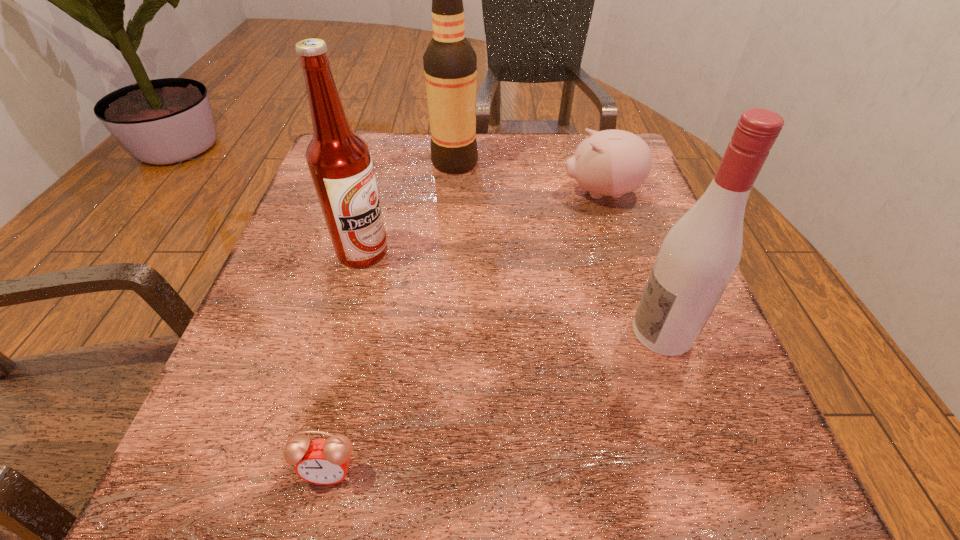
Find the location of a particular element. This screenshot has width=960, height=540. vacant space located on the label of the farthest alcohol is located at coordinates (633, 163).

Where is `free space located on the label side of the second nearest alcohol`? The width and height of the screenshot is (960, 540). free space located on the label side of the second nearest alcohol is located at coordinates (468, 251).

Identify the location of vacant region located 0.140m on the label of the nearest alcohol. (544, 332).

Locate an element on the screen. This screenshot has width=960, height=540. free space located on the label of the nearest alcohol is located at coordinates (482, 332).

This screenshot has width=960, height=540. In order to click on vacant space situated 0.190m on the label of the nearest alcohol in this screenshot , I will do `click(513, 332)`.

Identify the location of free region located at the snout of the second farthest object. (384, 193).

The height and width of the screenshot is (540, 960). Identify the location of free region located at the snout of the second farthest object. (384, 193).

You are a GUI agent. You are given a task and a screenshot of the screen. Output one action in this format:
    pyautogui.click(x=<x>, y=<y>)
    Task: Click on the vacant area situated 0.350m at the snout of the second farthest object
    
    Given the screenshot: What is the action you would take?
    (402, 193)

Where is `alcohol located in the far edge section of the desktop`? This screenshot has height=540, width=960. alcohol located in the far edge section of the desktop is located at coordinates (450, 63).

Locate an element on the screen. piggy bank that is at the far edge is located at coordinates (612, 162).